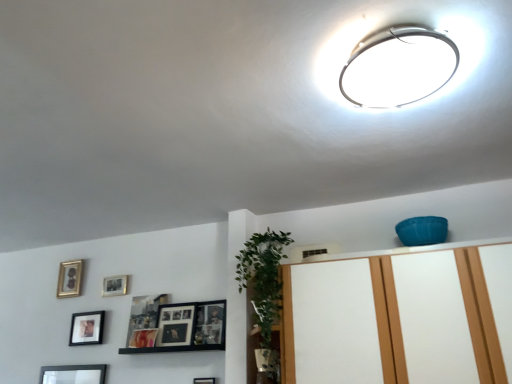
The height and width of the screenshot is (384, 512). Find the location of `black matte picture frame at lower left, the fourth picture frame in the right-to-left sequence`. black matte picture frame at lower left, the fourth picture frame in the right-to-left sequence is located at coordinates (86, 328).

What do you see at coordinates (204, 380) in the screenshot? I see `black matte picture frame at lower center, the 1th picture frame when ordered from right to left` at bounding box center [204, 380].

What do you see at coordinates (115, 285) in the screenshot?
I see `matte black picture frame at upper left, the 2th picture frame in the back-to-front sequence` at bounding box center [115, 285].

Identify the location of white glossy ceiling light at upper center. (398, 66).

Measure the distance between point (356,91) and camera.

3.85 feet.

What is the approximate width of gold metallic picture frame at upper left, which is the 1th picture frame from back to front?

The width of gold metallic picture frame at upper left, which is the 1th picture frame from back to front, is 0.99 inches.

At what (x,y) coordinates should I click in order to perform the action: click on green leafy plant at center. Please return your answer as a coordinate pair (x, y). The height and width of the screenshot is (384, 512). Looking at the image, I should click on (263, 276).

Who is taller, matte black picture frame at center left, arranged as the 2th picture frame when viewed from the right, or black matte picture frame at lower left, the fourth picture frame in the right-to-left sequence?

With more height is matte black picture frame at center left, arranged as the 2th picture frame when viewed from the right.

Considering the sizes of objects matte black picture frame at center left, the second picture frame from the front, and black matte picture frame at lower left, which is the 3th picture frame in back-to-front order, in the image provided, who is bigger, matte black picture frame at center left, the second picture frame from the front, or black matte picture frame at lower left, which is the 3th picture frame in back-to-front order,?

With larger size is matte black picture frame at center left, the second picture frame from the front.

Is matte black picture frame at center left, which is counted as the fourth picture frame, starting from the back, at the left side of black matte picture frame at lower left, which is counted as the 2th picture frame, starting from the left?

No.

Which is nearer, [429,30] or [103,284]?

Point [429,30].

Considering the sizes of objects white glossy ceiling light at upper center and matte black picture frame at upper left, marked as the third picture frame in a left-to-right arrangement, in the image provided, who is shorter, white glossy ceiling light at upper center or matte black picture frame at upper left, marked as the third picture frame in a left-to-right arrangement,?

white glossy ceiling light at upper center is shorter.

From the image's perspective, which one is positioned higher, white glossy ceiling light at upper center or matte black picture frame at upper left, marked as the third picture frame in a left-to-right arrangement?

white glossy ceiling light at upper center is shown above in the image.

Considering their positions, is white glossy ceiling light at upper center located in front of or behind matte black picture frame at upper left, which appears as the 4th picture frame when viewed from the front?

In the image, white glossy ceiling light at upper center appears in front of matte black picture frame at upper left, which appears as the 4th picture frame when viewed from the front.

Which of these two, matte black picture frame at center left, which is counted as the fourth picture frame, starting from the back, or white glossy dresser at upper center, is bigger?

white glossy dresser at upper center is bigger.

How distant is matte black picture frame at center left, arranged as the 2th picture frame when viewed from the right, from white glossy dresser at upper center?

A distance of 3.69 feet exists between matte black picture frame at center left, arranged as the 2th picture frame when viewed from the right, and white glossy dresser at upper center.

I want to click on picture frame that is the 1st one when counting downward from the white glossy dresser at upper center (from the image's perspective), so click(x=143, y=316).

Are matte black picture frame at center left, which is counted as the fourth picture frame, starting from the back, and white glossy dresser at upper center beside each other?

No, matte black picture frame at center left, which is counted as the fourth picture frame, starting from the back, is not beside white glossy dresser at upper center.

In terms of width, does black matte picture frame at lower center, positioned as the 5th picture frame in back-to-front order, look wider or thinner when compared to black matte picture frame at lower left, the third picture frame when ordered from front to back?

Considering their sizes, black matte picture frame at lower center, positioned as the 5th picture frame in back-to-front order, looks slimmer than black matte picture frame at lower left, the third picture frame when ordered from front to back.

Is black matte picture frame at lower center, positioned as the 5th picture frame in back-to-front order, closer to camera compared to black matte picture frame at lower left, which is counted as the 2th picture frame, starting from the left?

Yes, black matte picture frame at lower center, positioned as the 5th picture frame in back-to-front order, is closer to the camera.

Is black matte picture frame at lower center, which is the 1th picture frame from front to back, in contact with black matte picture frame at lower left, which is the 3th picture frame in back-to-front order?

No, black matte picture frame at lower center, which is the 1th picture frame from front to back, is not making contact with black matte picture frame at lower left, which is the 3th picture frame in back-to-front order.

Does black matte picture frame at lower center, positioned as the fifth picture frame in left-to-right order, appear on the right side of black matte picture frame at lower left, the third picture frame when ordered from front to back?

Yes.

From the image's perspective, which one is positioned lower, white glossy dresser at upper center or matte black picture frame at center left, the fourth picture frame from the left?

matte black picture frame at center left, the fourth picture frame from the left, is shown below in the image.

Is point (463, 346) positioned after point (154, 307)?

That is False.

Is white glossy dresser at upper center facing away from matte black picture frame at center left, the fourth picture frame from the left?

No, matte black picture frame at center left, the fourth picture frame from the left, is not at the back of white glossy dresser at upper center.

Is white glossy dresser at upper center placed right next to matte black picture frame at center left, the second picture frame from the front?

No, white glossy dresser at upper center is not with matte black picture frame at center left, the second picture frame from the front.

Is matte black picture frame at center left, the second picture frame from the front, to the right of black matte picture frame at lower center, which is the 1th picture frame from front to back, from the viewer's perspective?

In fact, matte black picture frame at center left, the second picture frame from the front, is to the left of black matte picture frame at lower center, which is the 1th picture frame from front to back.

Is matte black picture frame at center left, arranged as the 2th picture frame when viewed from the right, not near black matte picture frame at lower center, positioned as the fifth picture frame in left-to-right order?

No, matte black picture frame at center left, arranged as the 2th picture frame when viewed from the right, is in close proximity to black matte picture frame at lower center, positioned as the fifth picture frame in left-to-right order.

Is matte black picture frame at center left, the fourth picture frame from the left, inside the boundaries of black matte picture frame at lower center, positioned as the 5th picture frame in back-to-front order, or outside?

matte black picture frame at center left, the fourth picture frame from the left, cannot be found inside black matte picture frame at lower center, positioned as the 5th picture frame in back-to-front order.

Does point (154, 307) come behind point (201, 379)?

Yes, it is behind point (201, 379).

Between gold metallic picture frame at upper left, which is the 1th picture frame from left to right, and green leafy plant at center, which one appears on the left side from the viewer's perspective?

gold metallic picture frame at upper left, which is the 1th picture frame from left to right.

How different are the orientations of gold metallic picture frame at upper left, the fifth picture frame viewed from the front, and green leafy plant at center in degrees?

6.43 degrees.

From the image's perspective, would you say gold metallic picture frame at upper left, the fifth picture frame viewed from the front, is shown under green leafy plant at center?

Indeed, from the image's perspective, gold metallic picture frame at upper left, the fifth picture frame viewed from the front, is shown beneath green leafy plant at center.

Which picture frame is the 2nd one when counting from the left side of the matte black picture frame at center left, arranged as the 2th picture frame when viewed from the right? Please provide its 2D coordinates.

[(86, 328)]

Locate an element on the screen. the 2nd picture frame located beneath the white glossy ceiling light at upper center (from a real-world perspective) is located at coordinates (115, 285).

Which object lies further to the anchor point black matte picture frame at lower left, which is the 3th picture frame in back-to-front order, white glossy dresser at upper center or green leafy plant at center?

Among the two, white glossy dresser at upper center is located further to black matte picture frame at lower left, which is the 3th picture frame in back-to-front order.

When comparing their distances from black matte picture frame at lower center, the 1th picture frame when ordered from right to left, does black matte picture frame at lower left, which is the 3th picture frame in back-to-front order, or matte black picture frame at center left, which is counted as the fourth picture frame, starting from the back, seem closer?

Among the two, matte black picture frame at center left, which is counted as the fourth picture frame, starting from the back, is located nearer to black matte picture frame at lower center, the 1th picture frame when ordered from right to left.

From the image, which object appears to be nearer to black matte picture frame at lower center, positioned as the fifth picture frame in left-to-right order, green leafy plant at center or gold metallic picture frame at upper left, the 5th picture frame from the right?

green leafy plant at center.

Based on their spatial positions, is black matte picture frame at lower center, positioned as the fifth picture frame in left-to-right order, or green leafy plant at center closer to gold metallic picture frame at upper left, which is the 1th picture frame from back to front?

black matte picture frame at lower center, positioned as the fifth picture frame in left-to-right order, lies closer to gold metallic picture frame at upper left, which is the 1th picture frame from back to front, than the other object.

Which object lies further to the anchor point black matte picture frame at lower left, which is the 3th picture frame in back-to-front order, green leafy plant at center or matte black picture frame at center left, arranged as the 2th picture frame when viewed from the right?

green leafy plant at center.

From the image, which object appears to be farther from white glossy dresser at upper center, white glossy ceiling light at upper center or black matte picture frame at lower center, positioned as the 5th picture frame in back-to-front order?

Among the two, black matte picture frame at lower center, positioned as the 5th picture frame in back-to-front order, is located further to white glossy dresser at upper center.

Considering their positions, is gold metallic picture frame at upper left, the 5th picture frame from the right, positioned closer to white glossy dresser at upper center than black matte picture frame at lower center, the 1th picture frame when ordered from right to left?

Among the two, black matte picture frame at lower center, the 1th picture frame when ordered from right to left, is located nearer to white glossy dresser at upper center.

When comparing their distances from black matte picture frame at lower center, the 1th picture frame when ordered from right to left, does matte black picture frame at center left, the second picture frame from the front, or gold metallic picture frame at upper left, the fifth picture frame viewed from the front, seem further?

The object further to black matte picture frame at lower center, the 1th picture frame when ordered from right to left, is gold metallic picture frame at upper left, the fifth picture frame viewed from the front.

This screenshot has width=512, height=384. What are the coordinates of `picture frame between gold metallic picture frame at upper left, which is the 1th picture frame from back to front, and matte black picture frame at upper left, marked as the third picture frame in a left-to-right arrangement, from left to right` in the screenshot? It's located at (86, 328).

What are the coordinates of `houseplant situated between gold metallic picture frame at upper left, the 5th picture frame from the right, and white glossy dresser at upper center from left to right` in the screenshot? It's located at (263, 276).

Where is `houseplant between black matte picture frame at lower center, positioned as the fifth picture frame in left-to-right order, and white glossy dresser at upper center`? houseplant between black matte picture frame at lower center, positioned as the fifth picture frame in left-to-right order, and white glossy dresser at upper center is located at coordinates (263, 276).

Find the location of `dresser between white glossy ceiling light at upper center and matte black picture frame at upper left, marked as the third picture frame in a left-to-right arrangement, in the front-back direction`. dresser between white glossy ceiling light at upper center and matte black picture frame at upper left, marked as the third picture frame in a left-to-right arrangement, in the front-back direction is located at coordinates (400, 318).